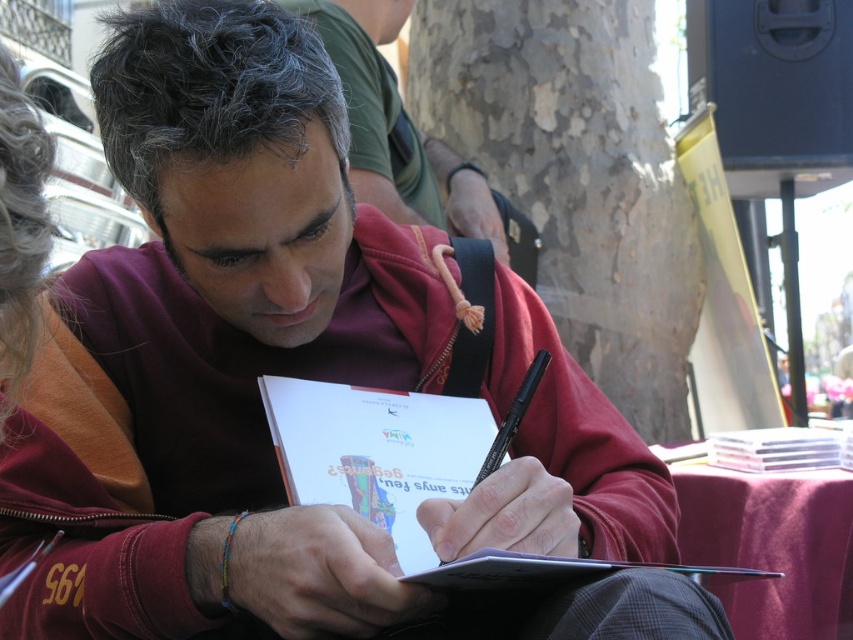
Question: Is white paper notebook at center below transparent plastic case at lower right?

Choices:
 (A) no
 (B) yes

Answer: (A)

Question: Is white paper notebook at center further to camera compared to transparent plastic case at lower right?

Choices:
 (A) yes
 (B) no

Answer: (B)

Question: From the image, what is the correct spatial relationship of white paper notebook at center in relation to transparent plastic case at lower right?

Choices:
 (A) right
 (B) left

Answer: (B)

Question: Among these points, which one is nearest to the camera?

Choices:
 (A) (477, 92)
 (B) (270, 390)

Answer: (B)

Question: Based on their relative distances, which object is nearer to the white paper notebook at center?

Choices:
 (A) matte red jacket at center
 (B) smooth bark tree at center
 (C) transparent plastic case at lower right

Answer: (C)

Question: Based on their relative distances, which object is nearer to the smooth bark tree at center?

Choices:
 (A) transparent plastic case at lower right
 (B) matte red jacket at center
 (C) white paper notebook at center

Answer: (B)